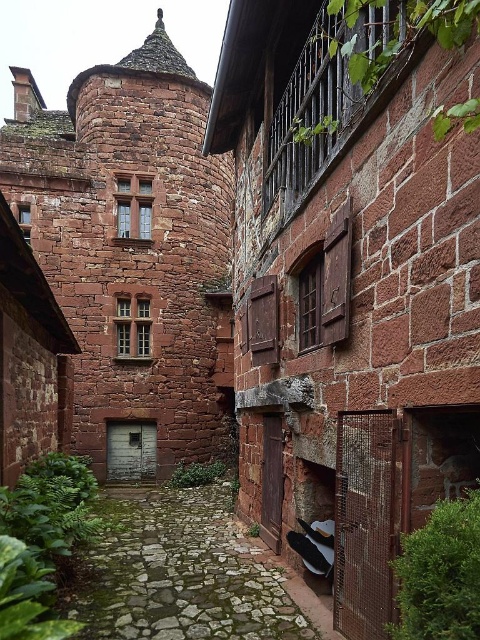
You are a knight approaching the rustic stone castle at center and the green mossy stone path at lower center. Which object is wider?

The rustic stone castle at center is wider than the green mossy stone path at lower center.

You are standing on the green mossy stone path at lower center and want to reach the rustic stone castle at center. In which direction should you walk to get there?

You should walk to the right because the rustic stone castle at center is located to the left of the green mossy stone path at lower center, so moving right from the path will lead you towards the castle.

You are a knight approaching the rustic stone castle at center and the green mossy stone path at lower center. Which object is closer to you as you approach the scene?

The rustic stone castle at center is closer to you because the green mossy stone path at lower center is positioned behind it.